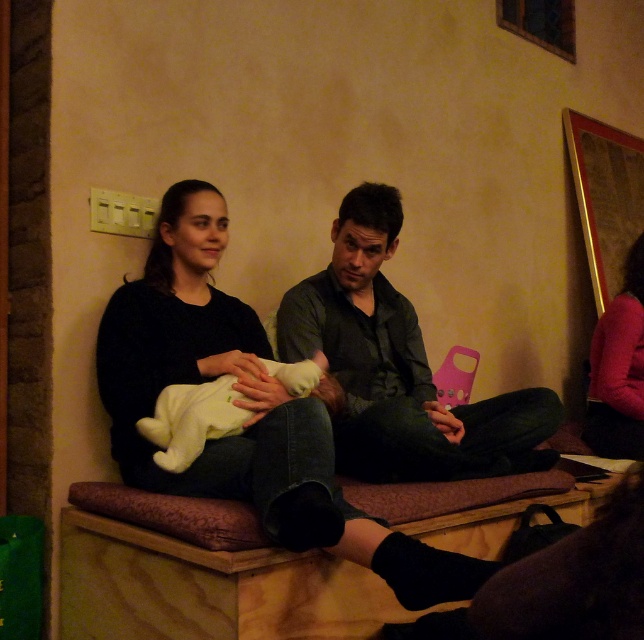
At what (x,y) coordinates should I click in order to perform the action: click on matte pink sweater at right. Please return your answer as a coordinate pair (x, y). This screenshot has height=640, width=644. Looking at the image, I should click on (618, 369).

Who is higher up, matte pink sweater at right or white soft baby at center?

matte pink sweater at right is above.

Is point (612, 301) closer to camera compared to point (182, 413)?

No, (612, 301) is behind (182, 413).

Where is `matte pink sweater at right`? matte pink sweater at right is located at coordinates (618, 369).

Does black matte sweater at center appear over matte pink sweater at right?

Incorrect, black matte sweater at center is not positioned above matte pink sweater at right.

Does point (108, 330) lie behind point (632, 326)?

No, it is not.

Who is more forward, (374, 561) or (632, 317)?

Point (374, 561) is in front.

The width and height of the screenshot is (644, 640). I want to click on black matte sweater at center, so click(x=242, y=406).

Is black matte sweater at center bigger than white soft baby at center?

Indeed, black matte sweater at center has a larger size compared to white soft baby at center.

Locate an element on the screen. Image resolution: width=644 pixels, height=640 pixels. black matte sweater at center is located at coordinates (242, 406).